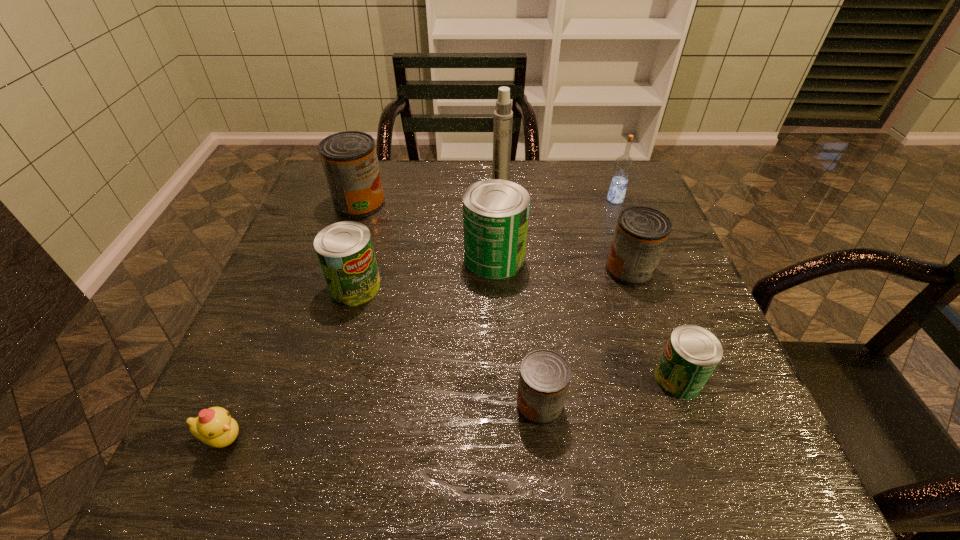
You are a GUI agent. You are given a task and a screenshot of the screen. Output one action in this format:
    pyautogui.click(x=<x>, y=<y>)
    Task: Click on the smallest green can
    This screenshot has height=540, width=960.
    Given the screenshot: What is the action you would take?
    pyautogui.click(x=692, y=353)

The width and height of the screenshot is (960, 540). Identify the location of the nearest red can. (544, 377).

Locate an element on the screen. the second red can from left to right is located at coordinates (544, 377).

The image size is (960, 540). Find the location of `duckling`. duckling is located at coordinates (214, 426).

In order to click on free space located 0.390m on the left of the aerosol can in this screenshot , I will do `click(356, 189)`.

Where is `free space located 0.350m on the front of the blue vodka`? The width and height of the screenshot is (960, 540). free space located 0.350m on the front of the blue vodka is located at coordinates (652, 299).

Locate an element on the screen. blank space located 0.330m on the front of the farthest can is located at coordinates (324, 313).

This screenshot has width=960, height=540. I want to click on free region located on the front of the biggest green can, so tap(500, 439).

The height and width of the screenshot is (540, 960). What are the coordinates of `free point located 0.400m on the back of the second farthest red can` in the screenshot? It's located at (594, 167).

Identify the location of blank space located 0.320m on the right of the second smallest green can. The height and width of the screenshot is (540, 960). (522, 287).